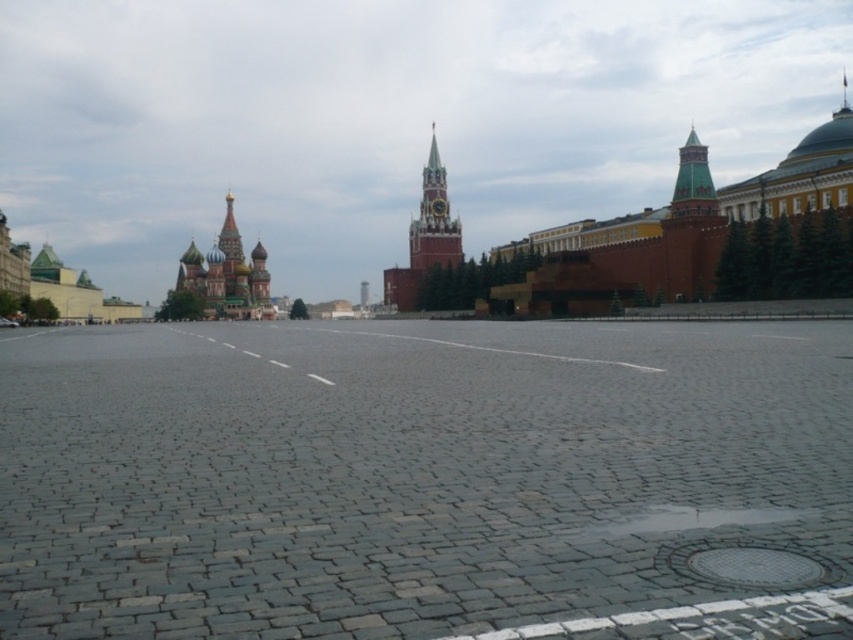
Based on the photo, is smooth stone clock tower at center closer to the viewer compared to golden domed tower at upper left?

Yes, smooth stone clock tower at center is closer to the viewer.

Is smooth stone clock tower at center to the right of golden domed tower at upper left from the viewer's perspective?

Indeed, smooth stone clock tower at center is positioned on the right side of golden domed tower at upper left.

The image size is (853, 640). In order to click on smooth stone clock tower at center in this screenshot , I will do `click(433, 220)`.

Which of these two, green copper tower at upper right or golden domed tower at upper left, stands taller?

golden domed tower at upper left

The width and height of the screenshot is (853, 640). Describe the element at coordinates (693, 180) in the screenshot. I see `green copper tower at upper right` at that location.

The image size is (853, 640). In order to click on green copper tower at upper right in this screenshot , I will do point(693,180).

Between shiny gold onion dome at center-left and golden domed tower at upper left, which one is positioned higher?

golden domed tower at upper left is above.

What do you see at coordinates (227, 275) in the screenshot? Image resolution: width=853 pixels, height=640 pixels. I see `shiny gold onion dome at center-left` at bounding box center [227, 275].

The height and width of the screenshot is (640, 853). Find the location of `shiny gold onion dome at center-left`. shiny gold onion dome at center-left is located at coordinates (227, 275).